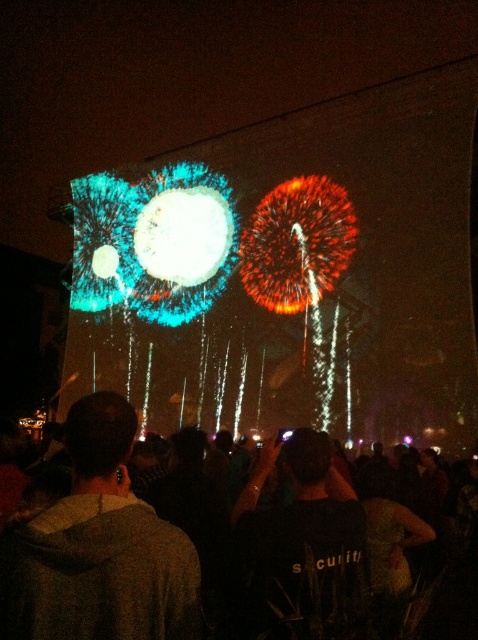
You are standing in the crowd watching the fireworks. You notice two bright points in the display. The first is at coordinates point (128, 572) and the second is at point (79, 556). Which point is closer to you?

Point (128, 572) is in front of point (79, 556), so the first point is closer to you.

You are standing in the crowd and want to move to the left side of the brown fabric at lower left. Which direction should you move relative to the black fabric crowd at lower center?

The black fabric crowd at lower center is positioned on the right side of brown fabric at lower left. To move to the left side of the brown fabric at lower left, you should move to the left of the brown fabric at lower left, away from the black fabric crowd at lower center.

You are standing at the back of the scene and want to take a photo of the fireworks display. There is a black fabric crowd at lower center and a brown fabric at lower left in your view. Which object should you avoid blocking your camera lens to ensure the fireworks are visible?

You should avoid blocking the brown fabric at lower left because the black fabric crowd at lower center is positioned under it, so the brown fabric at lower left might be in front and obstruct the view.